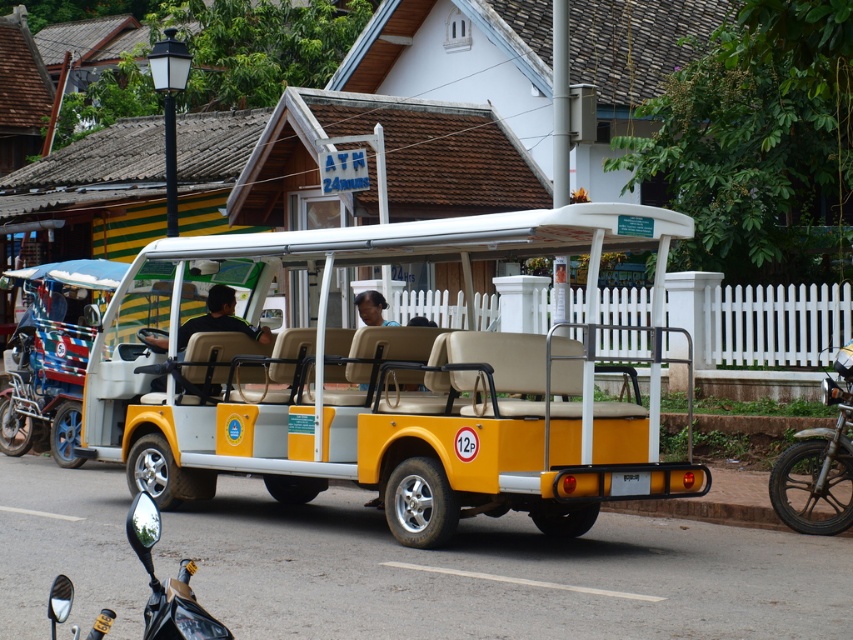
Can you confirm if metallic silver motorcycle at right is taller than dark brown skin at center?

Correct, metallic silver motorcycle at right is much taller as dark brown skin at center.

Looking at this image, who is more distant from viewer, (808, 468) or (357, 305)?

The point (357, 305) is behind.

You are a GUI agent. You are given a task and a screenshot of the screen. Output one action in this format:
    pyautogui.click(x=<x>, y=<y>)
    Task: Click on the metallic silver motorcycle at right
    The height and width of the screenshot is (640, 853).
    Given the screenshot: What is the action you would take?
    pyautogui.click(x=819, y=465)

Is yellow matte golf cart at center taller than black matte shirt at center?

Yes.

Is yellow matte golf cart at center above black matte shirt at center?

Actually, yellow matte golf cart at center is below black matte shirt at center.

Which is behind, point (467, 497) or point (204, 316)?

The point (204, 316) is behind.

The width and height of the screenshot is (853, 640). I want to click on yellow matte golf cart at center, so click(x=392, y=387).

Is metallic silver mirror at lower left closer to the viewer compared to dark brown skin at center?

Yes, metallic silver mirror at lower left is closer to the viewer.

Measure the distance between metallic silver mirror at lower left and dark brown skin at center.

metallic silver mirror at lower left and dark brown skin at center are 31.87 feet apart.

Is point (206, 630) farther from camera compared to point (379, 294)?

No, it is in front of (379, 294).

Find the location of a particular element. metallic silver mirror at lower left is located at coordinates (167, 582).